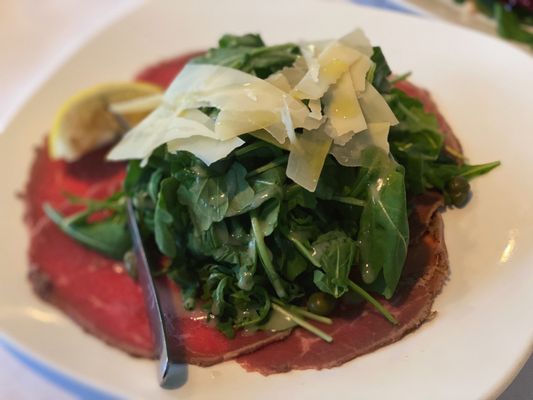
Identify the location of fork. The image size is (533, 400). (150, 290), (122, 125).